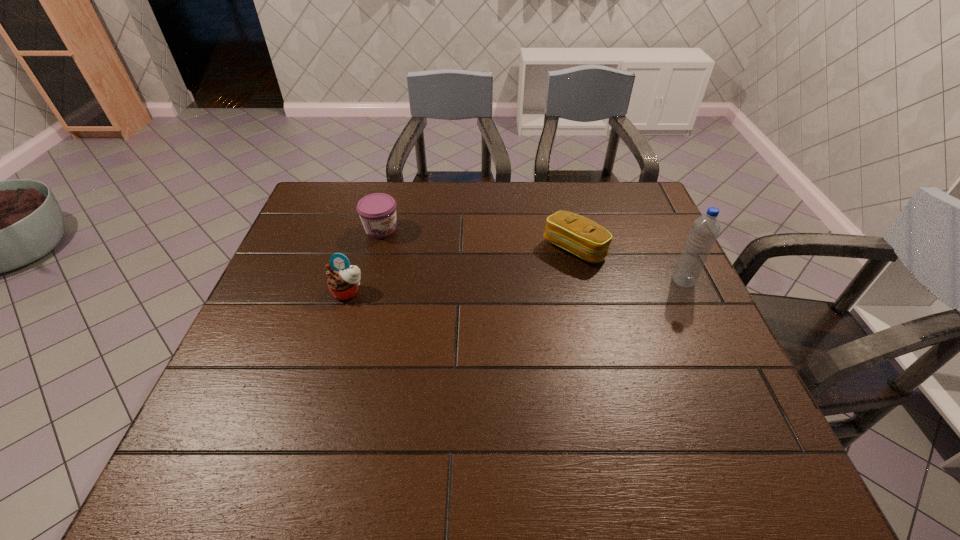
This screenshot has width=960, height=540. Identify the location of unoccupied area between the tallest object and the jam. (532, 255).

This screenshot has height=540, width=960. I want to click on vacant space that's between the clutch bag and the water bottle, so click(x=629, y=265).

At what (x,y) coordinates should I click in order to perform the action: click on vacant area that lies between the rightmost object and the clutch bag. Please return your answer as a coordinate pair (x, y). This screenshot has width=960, height=540. Looking at the image, I should click on (629, 265).

Locate an element on the screen. This screenshot has width=960, height=540. empty location between the second tallest object and the rightmost object is located at coordinates (516, 286).

You are a GUI agent. You are given a task and a screenshot of the screen. Output one action in this format:
    pyautogui.click(x=<x>, y=<y>)
    Task: Click on the unoccupied area between the jam and the third shortest object
    This screenshot has width=960, height=540.
    Given the screenshot: What is the action you would take?
    click(x=365, y=260)

The image size is (960, 540). In order to click on vacant region between the jam and the third shortest object in this screenshot , I will do `click(365, 260)`.

Locate an element on the screen. The width and height of the screenshot is (960, 540). free space that is in between the clutch bag and the water bottle is located at coordinates (629, 265).

Where is `free space between the tallest object and the jam`? Image resolution: width=960 pixels, height=540 pixels. free space between the tallest object and the jam is located at coordinates (532, 255).

Find the location of a particular element. This screenshot has height=540, width=960. vacant space in between the second object from right to left and the third shortest object is located at coordinates (461, 270).

The width and height of the screenshot is (960, 540). Find the location of `unoccupied area between the jam and the rightmost object`. unoccupied area between the jam and the rightmost object is located at coordinates (532, 255).